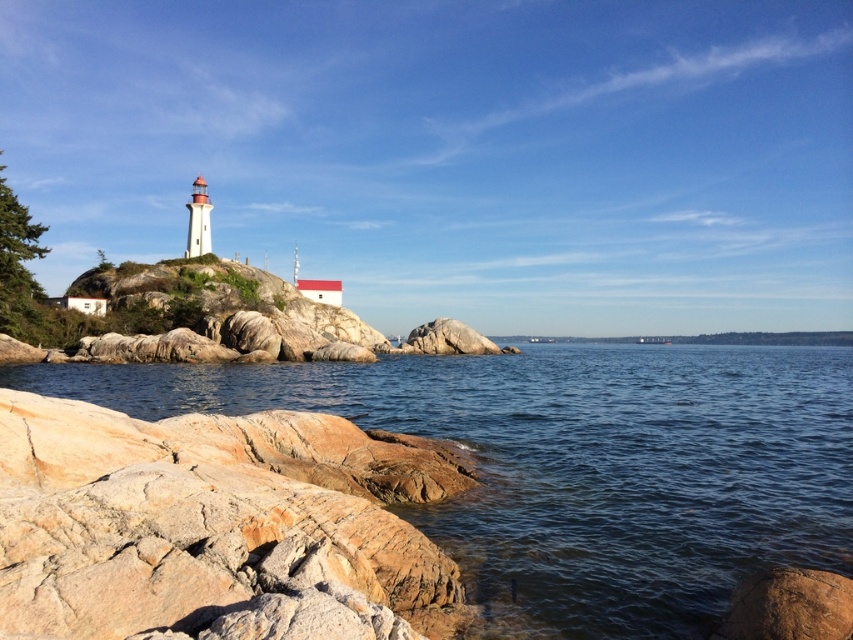
You are a photographer planning to capture the lighthouse and its surroundings. You notice the clear water at lower left and the brown rough rock at lower right in your frame. Which object occupies more space in the image?

The clear water at lower left occupies more space in the image as it is bigger than the brown rough rock at lower right according to the description.

You are standing on the shore looking at the scene. You see the clear water at lower left and the brown rough rock at lower right. Which object is closer to your right side?

The brown rough rock at lower right is closer to your right side because the clear water at lower left is positioned on the right side of it, meaning the rock is to the left of the water from your perspective.

You are a marine biologist studying the coastal ecosystem. You need to collect water samples from the clear water at lower left and analyze the rock composition of the brown rough rock at lower right. Given that your equipment can only cover a maximum distance of 30 meters between sampling points, can you collect both samples without moving your equipment more than once?

The distance between the clear water at lower left and the brown rough rock at lower right is 29.94 meters, which is within the 30 meters range. Therefore, you can collect both samples without moving your equipment more than once.